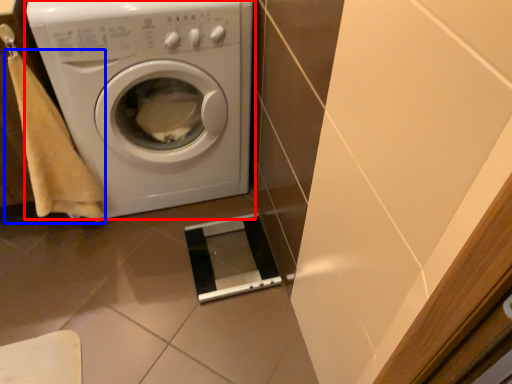
Question: Which of the following is the closest to the observer, washing machine (highlighted by a red box) or hand towel (highlighted by a blue box)?

Choices:
 (A) washing machine
 (B) hand towel

Answer: (B)